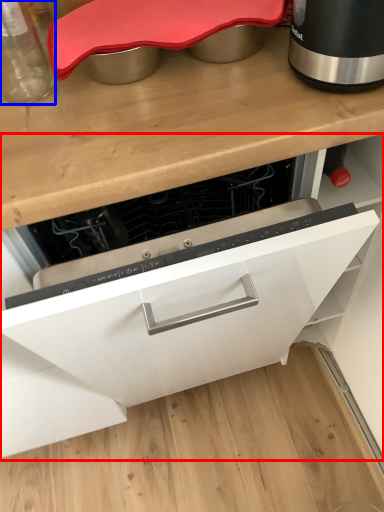
Question: Among these objects, which one is nearest to the camera, cabinetry (highlighted by a red box) or kitchen appliance (highlighted by a blue box)?

Choices:
 (A) cabinetry
 (B) kitchen appliance

Answer: (A)